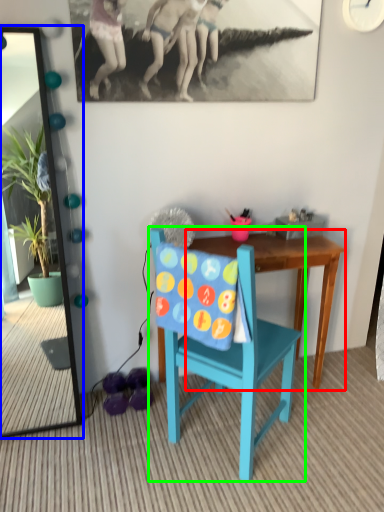
Question: Estimate the real-world distances between objects in this image. Which object is farther from table (highlighted by a red box), mirror (highlighted by a blue box) or chair (highlighted by a green box)?

Choices:
 (A) mirror
 (B) chair

Answer: (A)